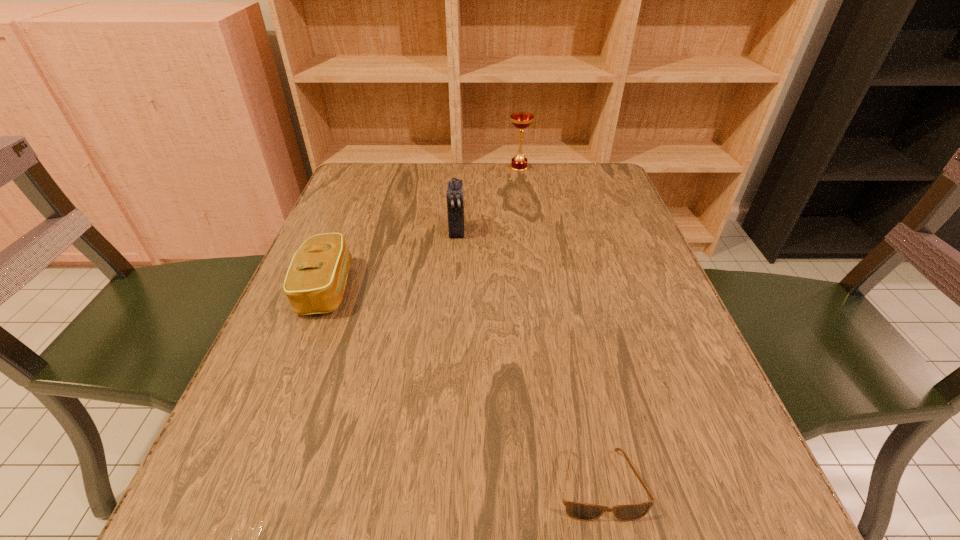
In the image, there is a desktop. Where is `vacant space at the far right corner`? Image resolution: width=960 pixels, height=540 pixels. vacant space at the far right corner is located at coordinates (564, 172).

Where is `empty location between the farthest object and the third object from right to left`? empty location between the farthest object and the third object from right to left is located at coordinates (488, 200).

Identify the location of free spot between the third tallest object and the nearest object. This screenshot has height=540, width=960. 463,386.

You are a GUI agent. You are given a task and a screenshot of the screen. Output one action in this format:
    pyautogui.click(x=<x>, y=<y>)
    Task: Click on the unoccupied position between the shortest object and the third tallest object
    This screenshot has width=960, height=540.
    Given the screenshot: What is the action you would take?
    pyautogui.click(x=463, y=386)

Identify the location of unoccupied area between the shorter clutch bag and the nearest object. This screenshot has width=960, height=540. (463, 386).

This screenshot has width=960, height=540. I want to click on free space between the farther clutch bag and the chalice, so click(488, 200).

Where is `free space between the taller clutch bag and the farthest object`? This screenshot has height=540, width=960. free space between the taller clutch bag and the farthest object is located at coordinates (488, 200).

Identify the location of free space between the sunglasses and the farthest object. (559, 326).

I want to click on free point between the chalice and the right clutch bag, so click(488, 200).

Identify the location of vacant area that lies between the third nearest object and the left clutch bag. (392, 260).